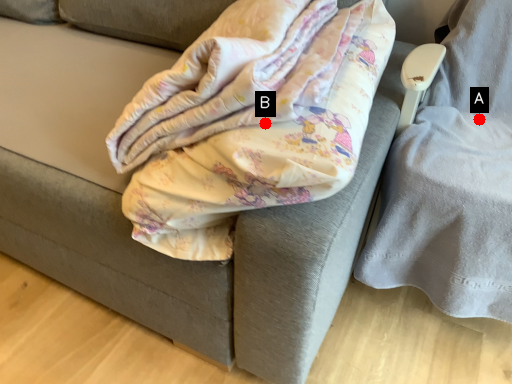
Question: Two points are circled on the image, labeled by A and B beside each circle. Among these points, which one is nearest to the camera?

Choices:
 (A) A is closer
 (B) B is closer

Answer: (B)